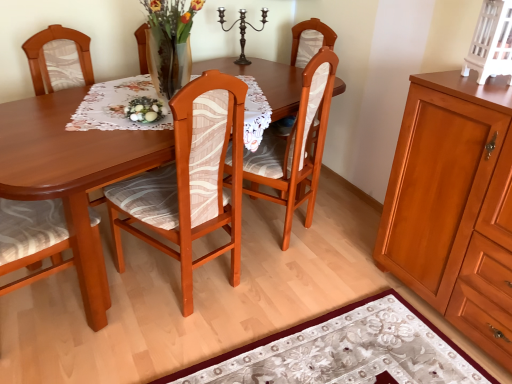
Where is `vacant area situated below wooden chair at center, positioned as the 2th chair in right-to-left order (from a real-world perspective)`? vacant area situated below wooden chair at center, positioned as the 2th chair in right-to-left order (from a real-world perspective) is located at coordinates (175, 281).